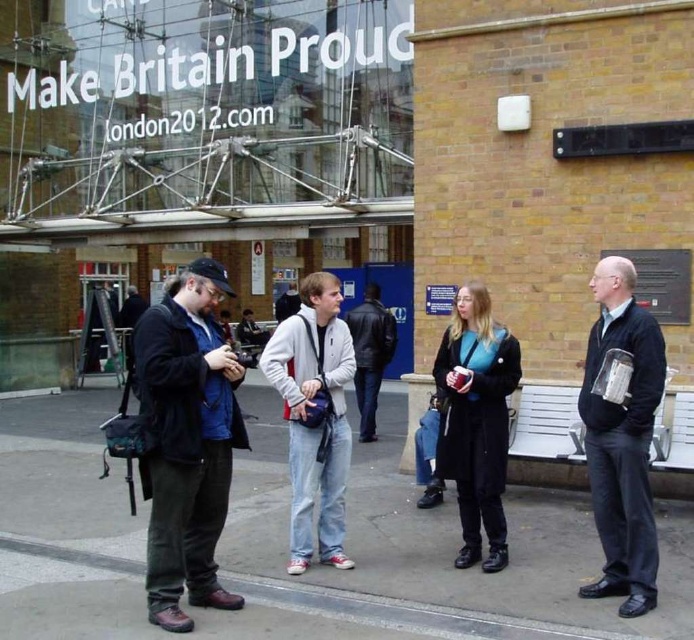
Is point (169, 378) positioned in front of point (643, 368)?

Yes, point (169, 378) is closer to viewer.

Who is taller, matte black jacket at center or dark gray fabric jacket at right?

dark gray fabric jacket at right is taller.

Image resolution: width=694 pixels, height=640 pixels. In order to click on matte black jacket at center in this screenshot , I will do `click(186, 440)`.

Who is positioned more to the left, white matte jacket at center or leather jacket at center?

From the viewer's perspective, white matte jacket at center appears more on the left side.

From the picture: Who is lower down, white matte jacket at center or leather jacket at center?

white matte jacket at center is below.

Which is in front, point (294, 483) or point (366, 346)?

Point (294, 483)

Locate an element on the screen. white matte jacket at center is located at coordinates (314, 417).

Does matte black jacket at center have a larger size compared to leather jacket at center?

No.

Which is in front, point (160, 609) or point (350, 317)?

Point (160, 609) is more forward.

Identify the location of matte black jacket at center. (186, 440).